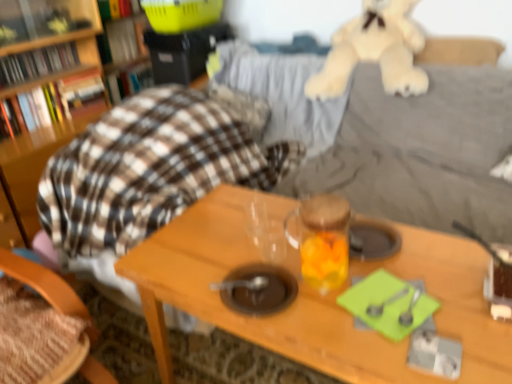
Identify the location of free spot to the right of transparent glass jar at center. (415, 264).